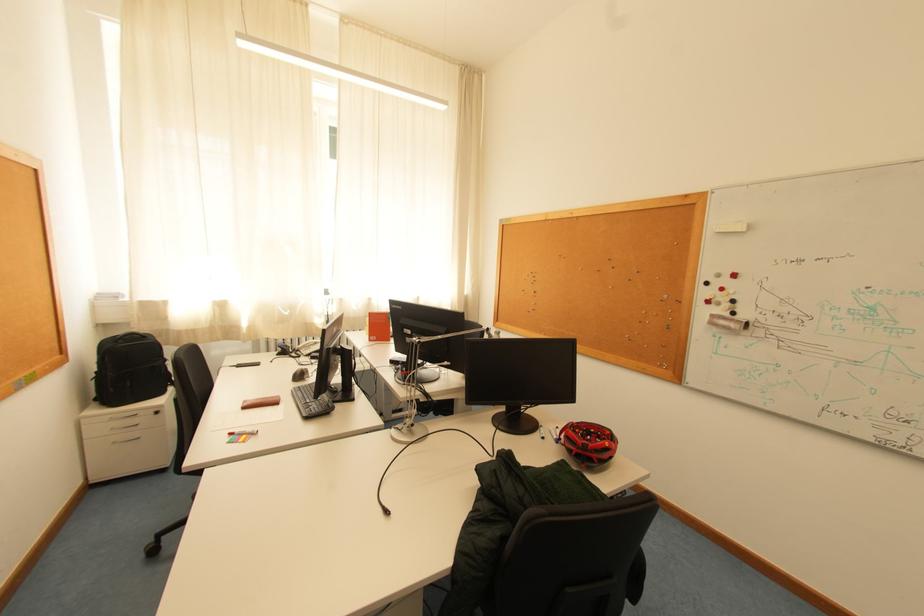
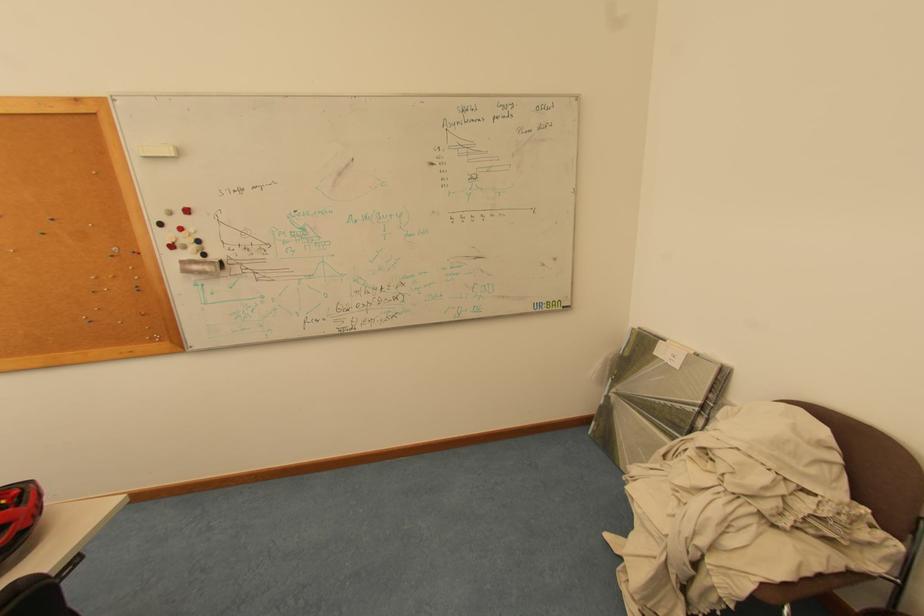
Where in the second image is the point corresponding to point 721,317 from the first image?

(190, 264)